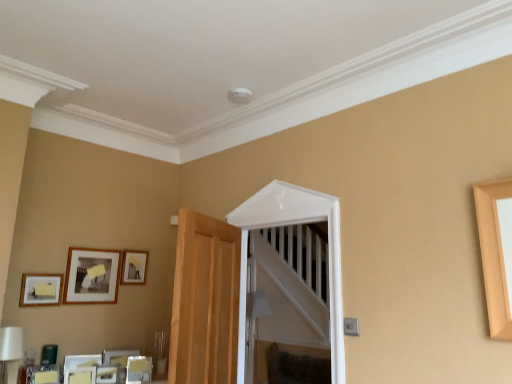
The width and height of the screenshot is (512, 384). What are the coordinates of `wooden picture frame at upper left, marked as the 4th picture frame in a bottom-to-top arrangement` in the screenshot? It's located at (134, 267).

The image size is (512, 384). What are the coordinates of `white glossy door at center` in the screenshot? It's located at click(x=290, y=224).

This screenshot has width=512, height=384. Identify the location of light brown wood door at center. (205, 301).

In order to face light brown wood door at center, should I rotate leftwards or rightwards?

Turn left approximately 6.298 degrees to face it.

What is the approximate width of matte wooden picture frame at lower left, which is the 1th picture frame from bottom to top?

matte wooden picture frame at lower left, which is the 1th picture frame from bottom to top, is 1.97 inches wide.

This screenshot has height=384, width=512. What do you see at coordinates (41, 289) in the screenshot?
I see `matte black picture frame at lower left, the second picture frame when ordered from bottom to top` at bounding box center [41, 289].

Image resolution: width=512 pixels, height=384 pixels. What are the coordinates of `wooden picture frame at upper left, marked as the 4th picture frame in a bottom-to-top arrangement` in the screenshot? It's located at (134, 267).

From the image's perspective, which one is positioned lower, matte black picture frame at upper left, the 2th picture frame viewed from the top, or matte black picture frame at lower left, the second picture frame when ordered from bottom to top?

From the image's view, matte black picture frame at lower left, the second picture frame when ordered from bottom to top, is below.

Is the position of matte black picture frame at upper left, the 2th picture frame viewed from the top, less distant than that of matte black picture frame at lower left, the second picture frame when ordered from bottom to top?

No, it is not.

How different are the orientations of matte black picture frame at upper left, the 2th picture frame viewed from the top, and matte black picture frame at lower left, the second picture frame when ordered from bottom to top, in degrees?

They differ by 1.27 degrees in their facing directions.

How distant is matte wooden picture frame at lower left, arranged as the fourth picture frame when viewed from the top, from matte black picture frame at upper left, the 3th picture frame ordered from the bottom?

A distance of 50.86 centimeters exists between matte wooden picture frame at lower left, arranged as the fourth picture frame when viewed from the top, and matte black picture frame at upper left, the 3th picture frame ordered from the bottom.

Who is shorter, matte wooden picture frame at lower left, which is the 1th picture frame from bottom to top, or matte black picture frame at upper left, the 3th picture frame ordered from the bottom?

matte wooden picture frame at lower left, which is the 1th picture frame from bottom to top.

Is matte wooden picture frame at lower left, which is the 1th picture frame from bottom to top, thinner than matte black picture frame at upper left, the 2th picture frame viewed from the top?

No, matte wooden picture frame at lower left, which is the 1th picture frame from bottom to top, is not thinner than matte black picture frame at upper left, the 2th picture frame viewed from the top.

How different are the orientations of wooden picture frame at upper left, which is counted as the 1th picture frame, starting from the top, and matte black picture frame at lower left, the second picture frame when ordered from bottom to top, in degrees?

They differ by 1.76 degrees in their facing directions.

Based on the photo, from a real-world perspective, is wooden picture frame at upper left, which is counted as the 1th picture frame, starting from the top, positioned above or below matte black picture frame at lower left, the second picture frame when ordered from bottom to top?

wooden picture frame at upper left, which is counted as the 1th picture frame, starting from the top, is above matte black picture frame at lower left, the second picture frame when ordered from bottom to top.

Considering the relative sizes of wooden picture frame at upper left, marked as the 4th picture frame in a bottom-to-top arrangement, and matte black picture frame at lower left, the second picture frame when ordered from bottom to top, in the image provided, is wooden picture frame at upper left, marked as the 4th picture frame in a bottom-to-top arrangement, taller than matte black picture frame at lower left, the second picture frame when ordered from bottom to top,?

Yes.

From the image's perspective, is white glossy door at center positioned above or below matte black picture frame at lower left, the second picture frame when ordered from bottom to top?

Clearly, from the image's perspective, white glossy door at center is above matte black picture frame at lower left, the second picture frame when ordered from bottom to top.

Which is in front, point (322, 208) or point (58, 285)?

The point (322, 208) is closer to the camera.

From a real-world perspective, is white glossy door at center positioned above or below matte black picture frame at lower left, the 3th picture frame viewed from the top?

white glossy door at center is situated higher than matte black picture frame at lower left, the 3th picture frame viewed from the top, in the real world.

Is white glossy door at center oriented towards matte black picture frame at lower left, the second picture frame when ordered from bottom to top?

No, white glossy door at center does not turn towards matte black picture frame at lower left, the second picture frame when ordered from bottom to top.

Is wooden picture frame at upper left, which is counted as the 1th picture frame, starting from the top, to the left of light brown wood door at center from the viewer's perspective?

Yes.

Considering the relative sizes of wooden picture frame at upper left, which is counted as the 1th picture frame, starting from the top, and light brown wood door at center in the image provided, is wooden picture frame at upper left, which is counted as the 1th picture frame, starting from the top, bigger than light brown wood door at center?

Actually, wooden picture frame at upper left, which is counted as the 1th picture frame, starting from the top, might be smaller than light brown wood door at center.

Is wooden picture frame at upper left, marked as the 4th picture frame in a bottom-to-top arrangement, wider than light brown wood door at center?

No.

Which object is thinner, matte black picture frame at lower left, the 3th picture frame viewed from the top, or matte black picture frame at upper left, the 2th picture frame viewed from the top?

matte black picture frame at upper left, the 2th picture frame viewed from the top.

Considering the relative sizes of matte black picture frame at lower left, the second picture frame when ordered from bottom to top, and matte black picture frame at upper left, the 3th picture frame ordered from the bottom, in the image provided, is matte black picture frame at lower left, the second picture frame when ordered from bottom to top, smaller than matte black picture frame at upper left, the 3th picture frame ordered from the bottom,?

Yes, matte black picture frame at lower left, the second picture frame when ordered from bottom to top, is smaller than matte black picture frame at upper left, the 3th picture frame ordered from the bottom.

From a real-world perspective, is matte black picture frame at lower left, the second picture frame when ordered from bottom to top, beneath matte black picture frame at upper left, the 3th picture frame ordered from the bottom?

Yes, from a real-world perspective, matte black picture frame at lower left, the second picture frame when ordered from bottom to top, is under matte black picture frame at upper left, the 3th picture frame ordered from the bottom.

Would you say matte black picture frame at upper left, the 3th picture frame ordered from the bottom, is part of matte black picture frame at lower left, the 3th picture frame viewed from the top,'s contents?

No, matte black picture frame at upper left, the 3th picture frame ordered from the bottom, is not inside matte black picture frame at lower left, the 3th picture frame viewed from the top.

Does matte black picture frame at lower left, the 3th picture frame viewed from the top, have a larger size compared to white glossy door at center?

Actually, matte black picture frame at lower left, the 3th picture frame viewed from the top, might be smaller than white glossy door at center.

Is the surface of matte black picture frame at lower left, the 3th picture frame viewed from the top, in direct contact with white glossy door at center?

No.

Which object is further away from the camera taking this photo, matte black picture frame at lower left, the 3th picture frame viewed from the top, or white glossy door at center?

matte black picture frame at lower left, the 3th picture frame viewed from the top, is further from the camera.

How distant is matte black picture frame at lower left, the second picture frame when ordered from bottom to top, from white glossy door at center?

matte black picture frame at lower left, the second picture frame when ordered from bottom to top, and white glossy door at center are 1.45 meters apart from each other.

Identify the location of the 2nd picture frame to the right of the matte black picture frame at lower left, the 3th picture frame viewed from the top, counting from the anchor's position. (92, 276).

Starting from the matte wooden picture frame at lower left, arranged as the fourth picture frame when viewed from the top, which picture frame is the 1st one behind? Please provide its 2D coordinates.

[(92, 276)]

Which object lies nearer to the anchor point matte black picture frame at upper left, the 3th picture frame ordered from the bottom, matte wooden picture frame at lower left, arranged as the fourth picture frame when viewed from the top, or wooden picture frame at upper left, which is counted as the 1th picture frame, starting from the top?

wooden picture frame at upper left, which is counted as the 1th picture frame, starting from the top, is closer to matte black picture frame at upper left, the 3th picture frame ordered from the bottom.

Based on their spatial positions, is white glossy door at center or matte black picture frame at lower left, the second picture frame when ordered from bottom to top, closer to light brown wood door at center?

Among the two, white glossy door at center is located nearer to light brown wood door at center.

Estimate the real-world distances between objects in this image. Which object is closer to light brown wood door at center, matte black picture frame at lower left, the second picture frame when ordered from bottom to top, or matte black picture frame at upper left, the 3th picture frame ordered from the bottom?

matte black picture frame at upper left, the 3th picture frame ordered from the bottom, lies closer to light brown wood door at center than the other object.

From the image, which object appears to be farther from matte black picture frame at lower left, the second picture frame when ordered from bottom to top, matte wooden picture frame at lower left, arranged as the fourth picture frame when viewed from the top, or white glossy door at center?

The object further to matte black picture frame at lower left, the second picture frame when ordered from bottom to top, is white glossy door at center.

Estimate the real-world distances between objects in this image. Which object is closer to matte wooden picture frame at lower left, arranged as the fourth picture frame when viewed from the top, wooden picture frame at upper left, which is counted as the 1th picture frame, starting from the top, or white glossy door at center?

wooden picture frame at upper left, which is counted as the 1th picture frame, starting from the top.

Looking at this image, based on their spatial positions, is matte wooden picture frame at lower left, arranged as the fourth picture frame when viewed from the top, or wooden picture frame at upper left, which is counted as the 1th picture frame, starting from the top, closer to white glossy door at center?

Based on the image, wooden picture frame at upper left, which is counted as the 1th picture frame, starting from the top, appears to be nearer to white glossy door at center.

Which object lies nearer to the anchor point matte black picture frame at lower left, the second picture frame when ordered from bottom to top, white glossy door at center or matte wooden picture frame at lower left, which is the 1th picture frame from bottom to top?

matte wooden picture frame at lower left, which is the 1th picture frame from bottom to top, is positioned closer to the anchor matte black picture frame at lower left, the second picture frame when ordered from bottom to top.

Estimate the real-world distances between objects in this image. Which object is further from matte black picture frame at upper left, the 2th picture frame viewed from the top, matte black picture frame at lower left, the second picture frame when ordered from bottom to top, or light brown wood door at center?

The object further to matte black picture frame at upper left, the 2th picture frame viewed from the top, is light brown wood door at center.

Where is `door between matte wooden picture frame at lower left, which is the 1th picture frame from bottom to top, and white glossy door at center, in the horizontal direction`? The image size is (512, 384). door between matte wooden picture frame at lower left, which is the 1th picture frame from bottom to top, and white glossy door at center, in the horizontal direction is located at coordinates tap(205, 301).

At what (x,y) coordinates should I click in order to perform the action: click on picture frame situated between matte black picture frame at upper left, the 2th picture frame viewed from the top, and white glossy door at center from left to right. Please return your answer as a coordinate pair (x, y). The height and width of the screenshot is (384, 512). Looking at the image, I should click on click(x=134, y=267).

Identify the location of glass door between light brown wood door at center and wooden picture frame at upper left, marked as the 4th picture frame in a bottom-to-top arrangement, from front to back. This screenshot has width=512, height=384. (290, 224).

The width and height of the screenshot is (512, 384). I want to click on picture frame between matte black picture frame at upper left, the 3th picture frame ordered from the bottom, and matte wooden picture frame at lower left, which is the 1th picture frame from bottom to top, from top to bottom, so click(41, 289).